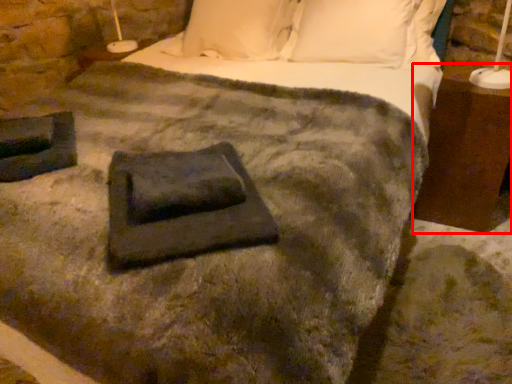
Question: In this image, where is nightstand (annotated by the red box) located relative to slate?

Choices:
 (A) right
 (B) left

Answer: (A)